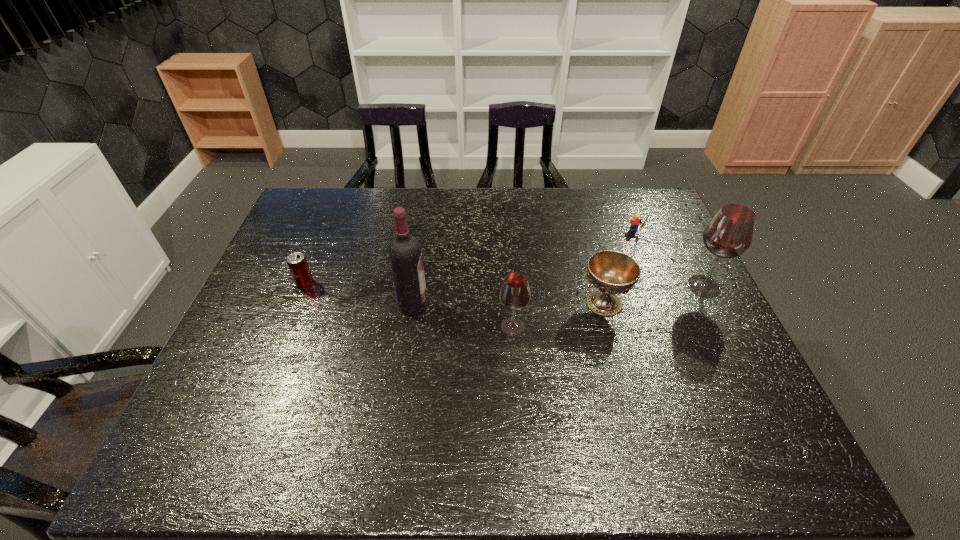
Image resolution: width=960 pixels, height=540 pixels. I want to click on the third tallest object, so click(x=514, y=294).

This screenshot has height=540, width=960. What are the coordinates of `the nearer wineglass` in the screenshot? It's located at (514, 294).

I want to click on the second tallest object, so click(729, 234).

The width and height of the screenshot is (960, 540). I want to click on the taller wineglass, so click(x=729, y=234).

Find the location of `the farthest object`. the farthest object is located at coordinates (634, 223).

Locate an element on the screen. This screenshot has width=960, height=540. the fifth object from left to right is located at coordinates (634, 223).

This screenshot has height=540, width=960. Identify the location of wine bottle. (405, 253).

At what (x,y) coordinates should I click in order to perform the action: click on the fifth object from right to left. Please return your answer as a coordinate pair (x, y). The height and width of the screenshot is (540, 960). Looking at the image, I should click on (405, 253).

Where is `the leftmost object`? The image size is (960, 540). the leftmost object is located at coordinates (297, 263).

Locate an element on the screen. the third shortest object is located at coordinates [612, 272].